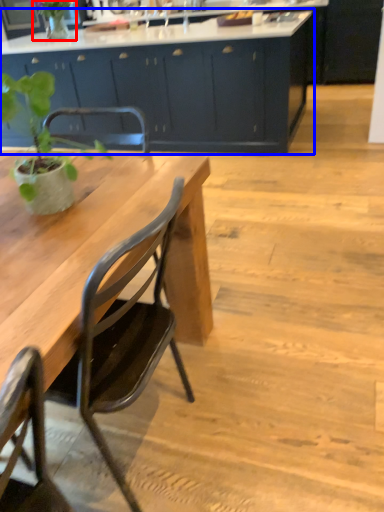
Question: Among these objects, which one is nearest to the camera, plant (highlighted by a red box) or cabinetry (highlighted by a blue box)?

Choices:
 (A) plant
 (B) cabinetry

Answer: (B)